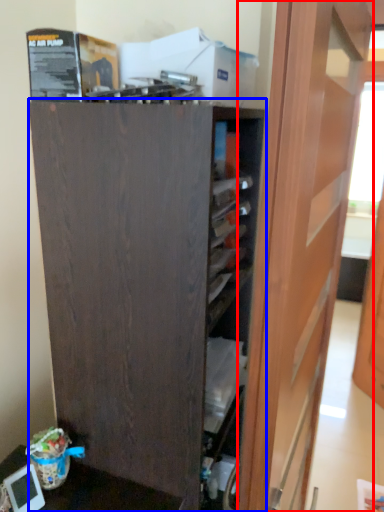
Question: Which object appears farthest to the camera in this image, door (highlighted by a red box) or cupboard (highlighted by a blue box)?

Choices:
 (A) door
 (B) cupboard

Answer: (B)